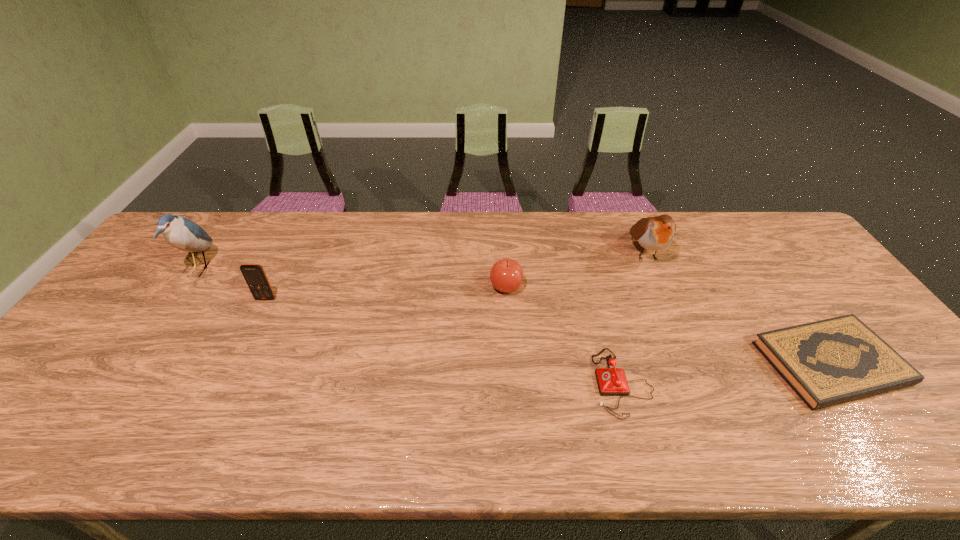
Where is `empty location between the leftmost object and the rightmost object`? This screenshot has height=540, width=960. empty location between the leftmost object and the rightmost object is located at coordinates (515, 316).

Image resolution: width=960 pixels, height=540 pixels. I want to click on free area in between the rightmost object and the telephone, so click(x=727, y=373).

At what (x,y) coordinates should I click in order to perform the action: click on blank region between the left bird and the rightmost object. Please return your answer as a coordinate pair (x, y). Image resolution: width=960 pixels, height=540 pixels. Looking at the image, I should click on (515, 316).

Locate an element on the screen. The image size is (960, 540). free spot between the apple and the fifth shortest object is located at coordinates (576, 269).

The height and width of the screenshot is (540, 960). Identify the location of free point between the hardback book and the second tallest object. (738, 308).

The width and height of the screenshot is (960, 540). In order to click on empty location between the left bird and the hardback book in this screenshot , I will do `click(515, 316)`.

This screenshot has width=960, height=540. Identify the location of free spot between the second object from left to right and the third object from right to left. (444, 341).

Where is `empty location between the third object from right to left and the apple`? The width and height of the screenshot is (960, 540). empty location between the third object from right to left and the apple is located at coordinates click(564, 335).

Locate which object is the fourth closest to the fourth object from right to left. Please provide its 2D coordinates. Your answer should be formatted as a tuple, i.e. [(x, y)], where the tuple contains the x and y coordinates of a point satisfying the conditions above.

[(254, 274)]

Select which object is the closest to the hardback book. Please provide its 2D coordinates. Your answer should be formatted as a tuple, i.e. [(x, y)], where the tuple contains the x and y coordinates of a point satisfying the conditions above.

[(655, 233)]